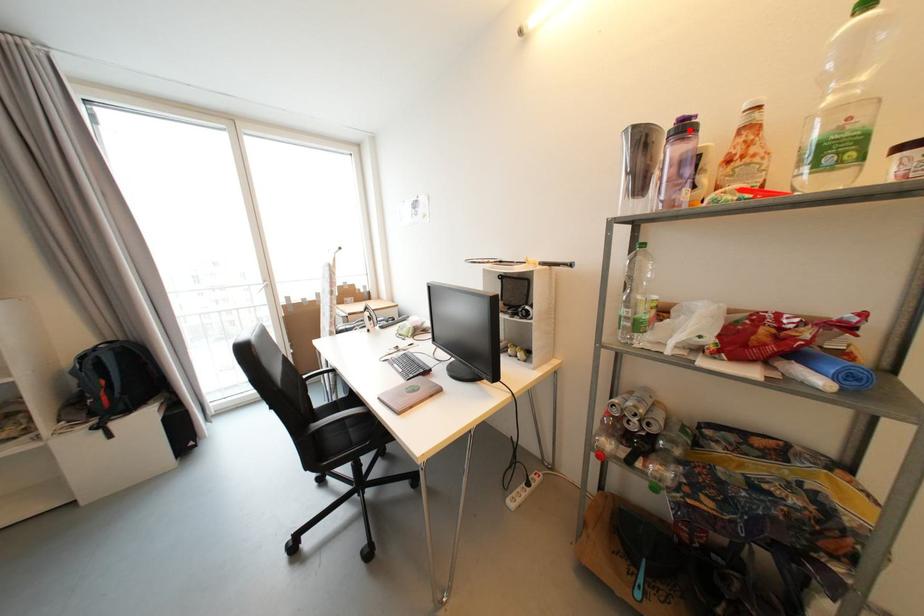
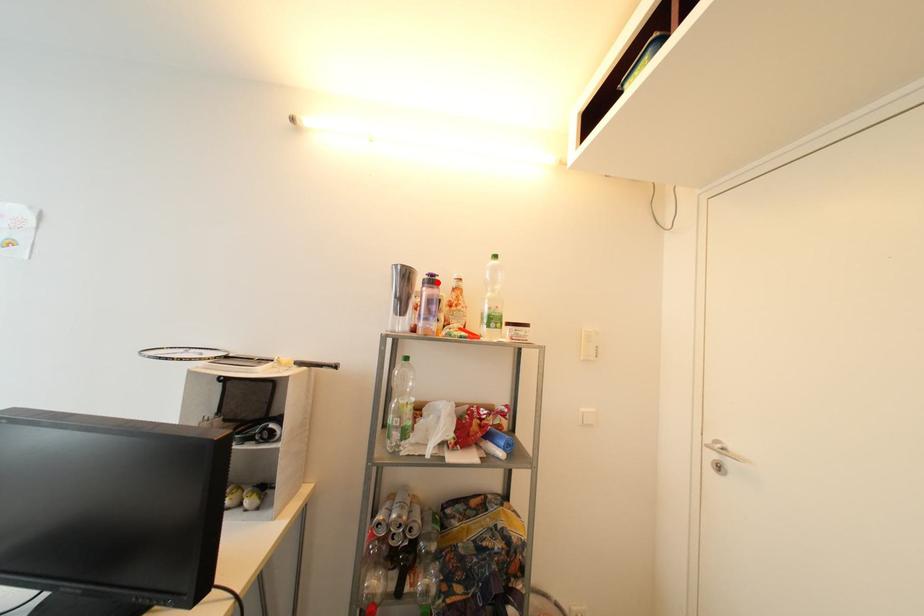
I am providing you with two images of the same scene from different viewpoints. A red point is marked on the first image and another point is marked on the second image. Do the highlighted points in image1 and image2 indicate the same real-world spot?

Yes